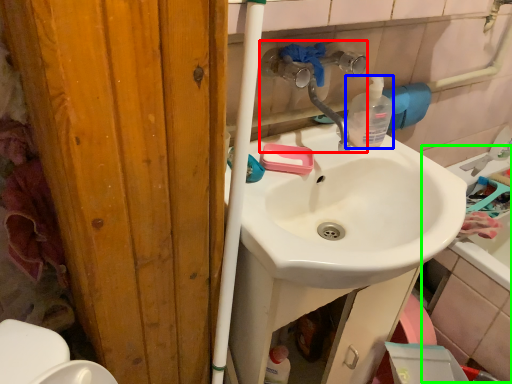
Question: Which is nearer to the plumbing fixture (highlighted by a red box)? bottle (highlighted by a blue box) or bath (highlighted by a green box).

Choices:
 (A) bottle
 (B) bath

Answer: (A)